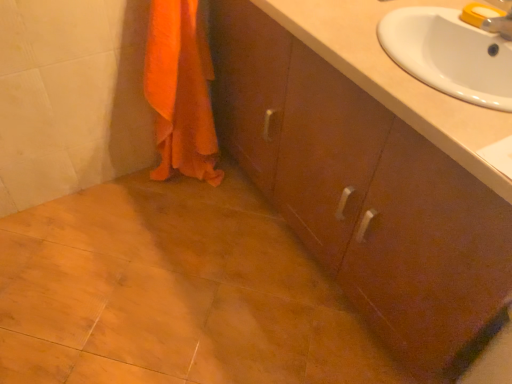
Question: Would you say white glossy sink at upper right is part of orange fabric towel at lower left's contents?

Choices:
 (A) yes
 (B) no

Answer: (B)

Question: From the image's perspective, is orange fabric towel at lower left located beneath white glossy sink at upper right?

Choices:
 (A) yes
 (B) no

Answer: (B)

Question: Is orange fabric towel at lower left located outside white glossy sink at upper right?

Choices:
 (A) no
 (B) yes

Answer: (B)

Question: Could you tell me if orange fabric towel at lower left is turned towards white glossy sink at upper right?

Choices:
 (A) no
 (B) yes

Answer: (A)

Question: From a real-world perspective, is orange fabric towel at lower left under white glossy sink at upper right?

Choices:
 (A) yes
 (B) no

Answer: (A)

Question: Would you consider orange fabric towel at lower left to be distant from white glossy sink at upper right?

Choices:
 (A) yes
 (B) no

Answer: (B)

Question: Is brown wood cabinet at center directly adjacent to white glossy sink at upper right?

Choices:
 (A) yes
 (B) no

Answer: (B)

Question: Is brown wood cabinet at center not within white glossy sink at upper right?

Choices:
 (A) yes
 (B) no

Answer: (A)

Question: Is brown wood cabinet at center looking in the opposite direction of white glossy sink at upper right?

Choices:
 (A) yes
 (B) no

Answer: (B)

Question: Considering the relative positions of brown wood cabinet at center and white glossy sink at upper right in the image provided, is brown wood cabinet at center to the left of white glossy sink at upper right from the viewer's perspective?

Choices:
 (A) no
 (B) yes

Answer: (B)

Question: Considering the relative sizes of brown wood cabinet at center and white glossy sink at upper right in the image provided, is brown wood cabinet at center taller than white glossy sink at upper right?

Choices:
 (A) yes
 (B) no

Answer: (A)

Question: Is brown wood cabinet at center thinner than white glossy sink at upper right?

Choices:
 (A) yes
 (B) no

Answer: (B)

Question: Considering the relative sizes of white glossy sink at upper right and brown wood cabinet at center in the image provided, is white glossy sink at upper right wider than brown wood cabinet at center?

Choices:
 (A) yes
 (B) no

Answer: (B)